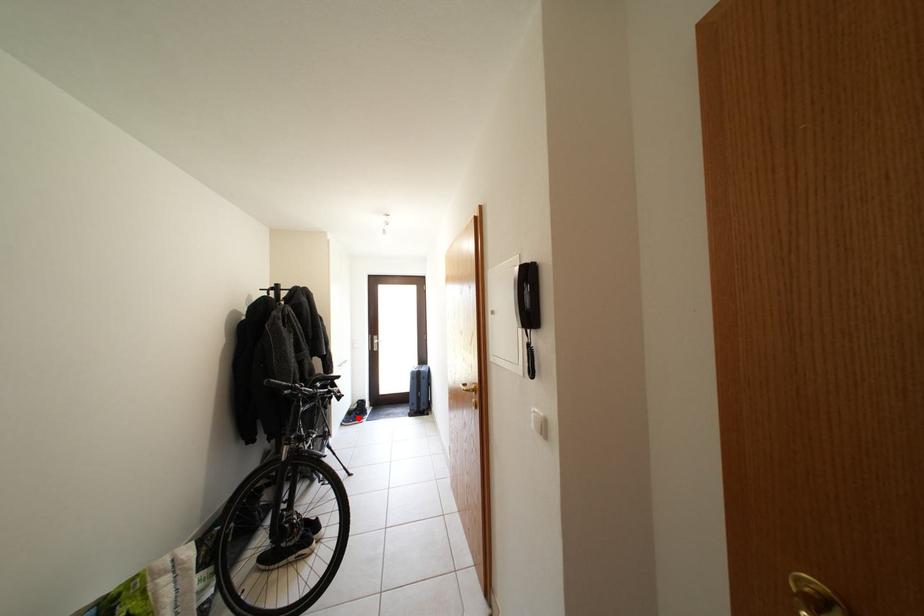
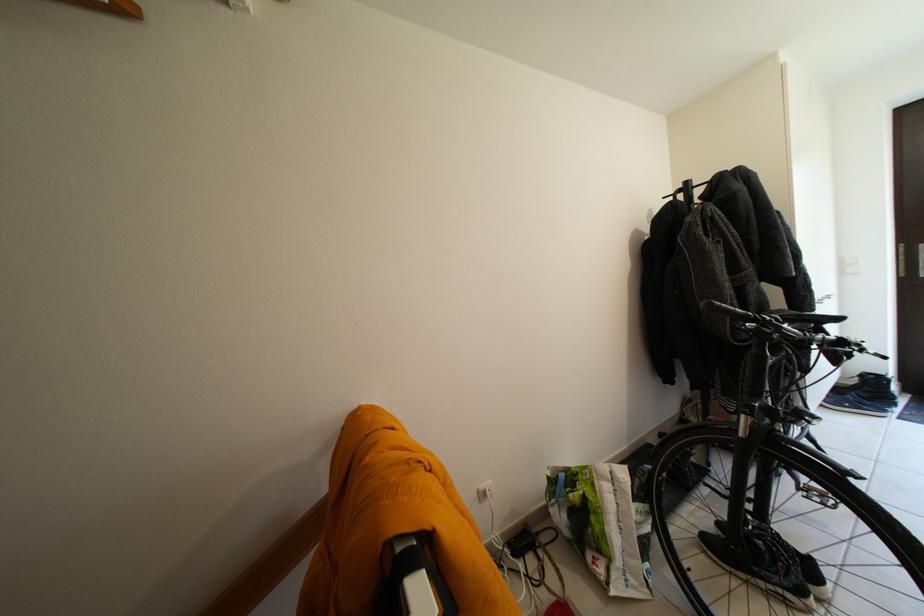
In the second image, find the point that corresponds to the highlighted location in the first image.

(845, 395)